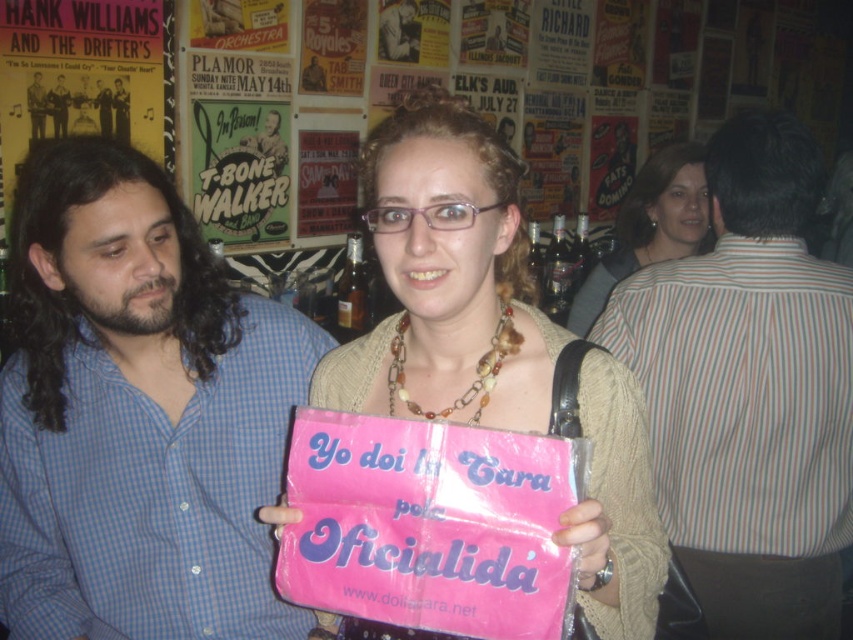
You are standing at the entrance of the venue and want to locate the pink paper sign at center. Based on the coordinates provided, in which direction should you look to find it?

The pink paper sign at center is located at coordinates point (447, 280), so you should look slightly to the right and upwards from the center of the image.

You are standing in the social gathering scene described. You need to locate the blue checkered shirt at center. What are the coordinates where you should look to find it?

The blue checkered shirt at center is located at coordinates point (137,413).